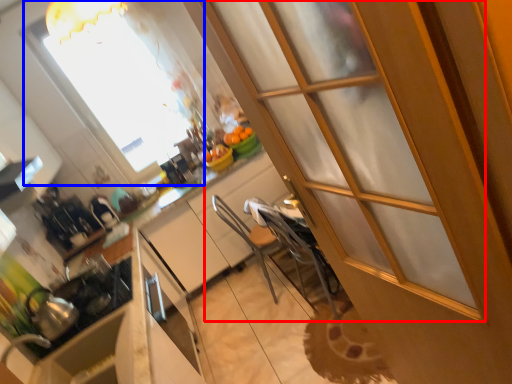
Question: Which point is closer to the camera, screen door (highlighted by a red box) or window (highlighted by a blue box)?

Choices:
 (A) screen door
 (B) window

Answer: (A)